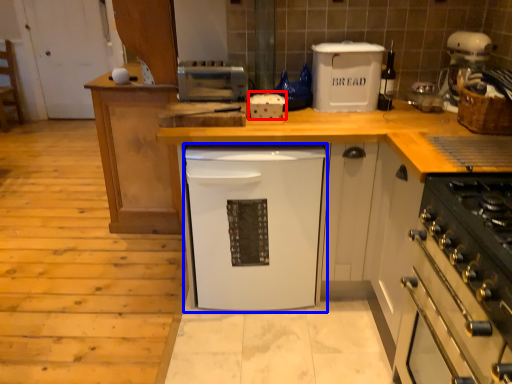
Question: Which of the following is the closest to the observer, appliance (highlighted by a red box) or dish washer (highlighted by a blue box)?

Choices:
 (A) appliance
 (B) dish washer

Answer: (B)